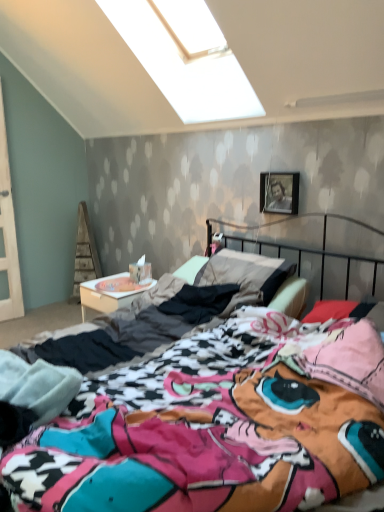
Question: Are white cardboard at lower left and multicolored fabric bed at center making contact?

Choices:
 (A) yes
 (B) no

Answer: (B)

Question: Would you say white cardboard at lower left is outside multicolored fabric bed at center?

Choices:
 (A) no
 (B) yes

Answer: (B)

Question: Can you confirm if white cardboard at lower left is smaller than multicolored fabric bed at center?

Choices:
 (A) no
 (B) yes

Answer: (B)

Question: Can you confirm if white cardboard at lower left is shorter than multicolored fabric bed at center?

Choices:
 (A) yes
 (B) no

Answer: (A)

Question: Can you confirm if white cardboard at lower left is thinner than multicolored fabric bed at center?

Choices:
 (A) yes
 (B) no

Answer: (A)

Question: Is multicolored fabric bed at center taller or shorter than metallic silver picture frame at upper right?

Choices:
 (A) tall
 (B) short

Answer: (A)

Question: Looking at the image, does multicolored fabric bed at center seem bigger or smaller compared to metallic silver picture frame at upper right?

Choices:
 (A) small
 (B) big

Answer: (B)

Question: Is multicolored fabric bed at center to the left or to the right of metallic silver picture frame at upper right in the image?

Choices:
 (A) left
 (B) right

Answer: (A)

Question: Is point (286, 323) positioned closer to the camera than point (294, 207)?

Choices:
 (A) farther
 (B) closer

Answer: (B)

Question: Based on their sizes in the image, would you say metallic silver picture frame at upper right is bigger or smaller than multicolored fabric bed at center?

Choices:
 (A) big
 (B) small

Answer: (B)

Question: Is metallic silver picture frame at upper right inside the boundaries of multicolored fabric bed at center, or outside?

Choices:
 (A) outside
 (B) inside

Answer: (A)

Question: From the image's perspective, relative to multicolored fabric bed at center, is metallic silver picture frame at upper right above or below?

Choices:
 (A) below
 (B) above

Answer: (B)

Question: Looking at their shapes, would you say metallic silver picture frame at upper right is wider or thinner than multicolored fabric bed at center?

Choices:
 (A) thin
 (B) wide

Answer: (A)

Question: Is metallic silver picture frame at upper right situated inside white cardboard at lower left or outside?

Choices:
 (A) inside
 (B) outside

Answer: (B)

Question: In the image, is metallic silver picture frame at upper right positioned in front of or behind white cardboard at lower left?

Choices:
 (A) front
 (B) behind

Answer: (A)